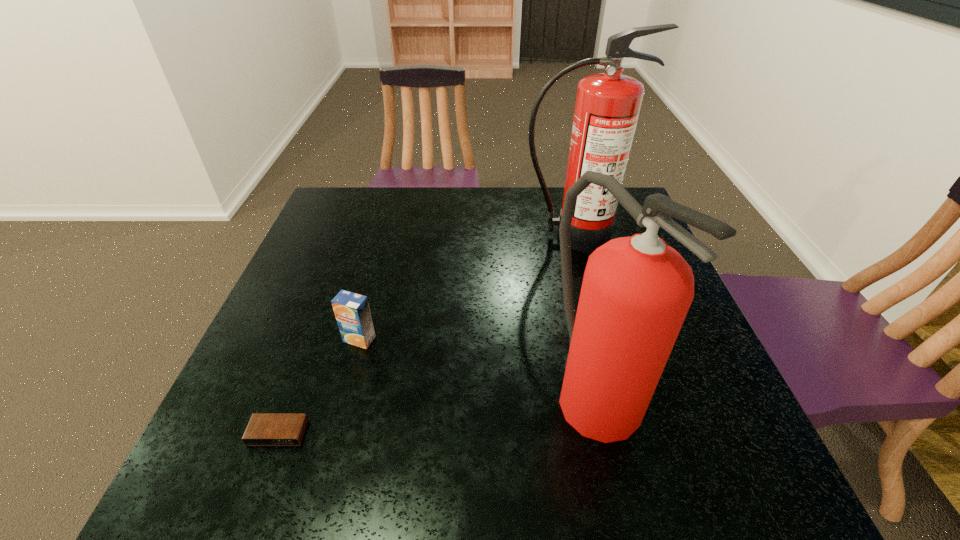
You are a GUI agent. You are given a task and a screenshot of the screen. Output one action in this format:
    pyautogui.click(x=<x>, y=<y>)
    Task: Click on the vacant region between the shorter fire extinguisher and the second shortest object
    The image size is (960, 540).
    Given the screenshot: What is the action you would take?
    click(476, 363)

Where is `unoccupied area between the second object from left to right and the shorter fire extinguisher`? unoccupied area between the second object from left to right and the shorter fire extinguisher is located at coordinates (476, 363).

The image size is (960, 540). What are the coordinates of `unoccupied area between the farthest object and the shortest object` in the screenshot? It's located at (425, 335).

Image resolution: width=960 pixels, height=540 pixels. Find the location of `vacant area that lies between the farther fire extinguisher and the alarm clock`. vacant area that lies between the farther fire extinguisher and the alarm clock is located at coordinates (425, 335).

This screenshot has height=540, width=960. I want to click on free point between the leftmost object and the shorter fire extinguisher, so click(x=436, y=410).

Identify the location of empty space between the shorter fire extinguisher and the third tallest object. (x=476, y=363).

At what (x,y) coordinates should I click in order to perform the action: click on free spot between the orange_juice and the alarm clock. Please return your answer as a coordinate pair (x, y). The height and width of the screenshot is (540, 960). Looking at the image, I should click on (319, 386).

The width and height of the screenshot is (960, 540). What are the coordinates of `vacant space that's between the shortest object and the third shortest object` in the screenshot? It's located at (436, 410).

The image size is (960, 540). I want to click on free space between the alarm clock and the farther fire extinguisher, so click(425, 335).

Point out which object is positioned as the third nearest to the alarm clock. Please provide its 2D coordinates. Your answer should be formatted as a tuple, i.e. [(x, y)], where the tuple contains the x and y coordinates of a point satisfying the conditions above.

[(607, 107)]